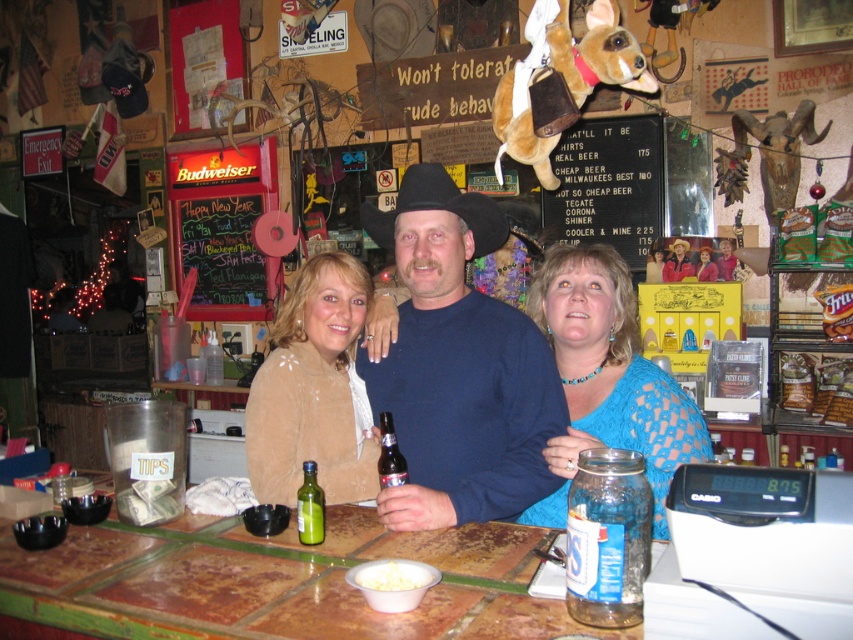
Question: Which of these objects is positioned closest to the clear glass jar at center?

Choices:
 (A) black felt cowboy hat at center
 (B) blue cotton shirt at center

Answer: (B)

Question: Which of the following is the closest to the observer?

Choices:
 (A) green glass bottle at center
 (B) suede jacket at center
 (C) black felt cowboy hat at center

Answer: (A)

Question: Can you confirm if suede jacket at center is positioned below black felt cowboy hat at center?

Choices:
 (A) no
 (B) yes

Answer: (B)

Question: Which object is closer to the camera taking this photo?

Choices:
 (A) chalkboard at center
 (B) green glass bottle at center
 (C) clear glass jar at center
 (D) blue cotton shirt at center

Answer: (C)

Question: Does chalkboard at center have a lesser width compared to black felt cowboy hat at center?

Choices:
 (A) yes
 (B) no

Answer: (B)

Question: Is blue lace dress at center to the left of clear glass jar at center from the viewer's perspective?

Choices:
 (A) yes
 (B) no

Answer: (B)